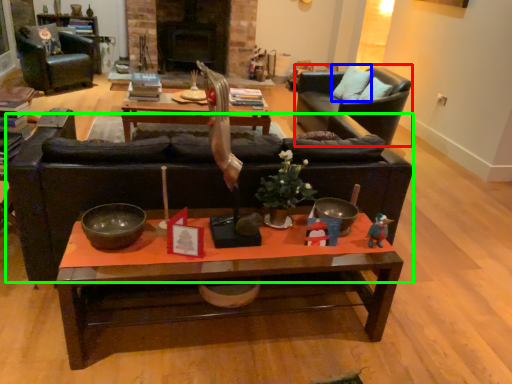
Question: Estimate the real-world distances between objects in this image. Which object is closer to chair (highlighted by a red box), pillow (highlighted by a blue box) or studio couch (highlighted by a green box)?

Choices:
 (A) pillow
 (B) studio couch

Answer: (A)